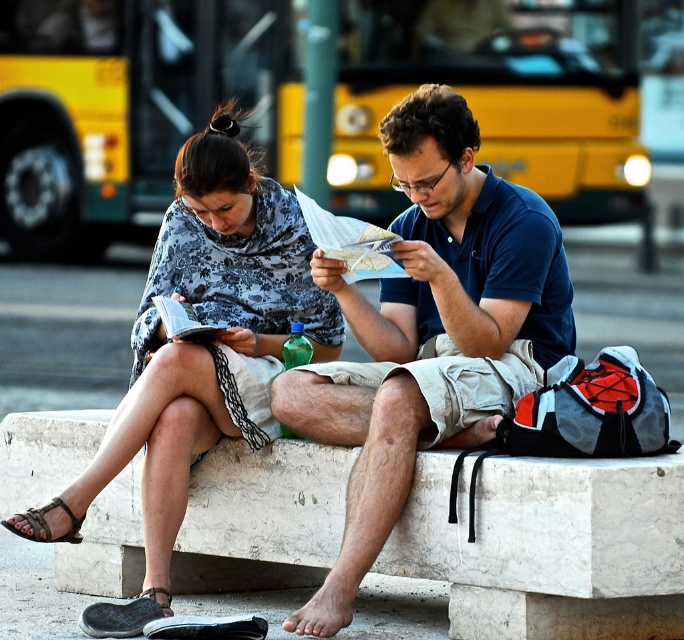
You are a tailor who needs to determine which item requires more fabric to alter between the blue cotton shirt at center and the floral fabric scarf at upper left. Based on the image, which item would need more fabric?

The blue cotton shirt at center has a larger size compared to the floral fabric scarf at upper left, so it requires more fabric for alterations.

You are a fashion designer observing this scene. You notice the blue cotton shirt at center and the floral fabric scarf at upper left. Which clothing item is positioned more to the right side of the image?

The blue cotton shirt at center is positioned to the right of the floral fabric scarf at upper left, so it is more to the right side of the image.